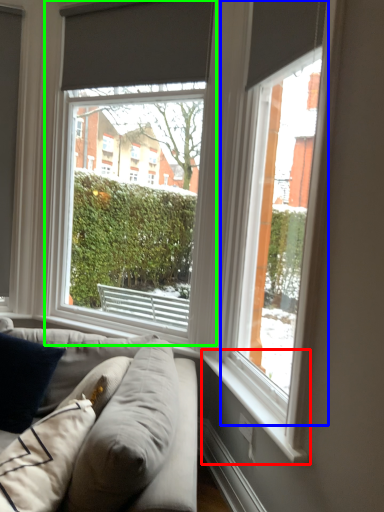
Question: Based on their relative distances, which object is nearer to window sill (highlighted by a red box)? Choose from window (highlighted by a blue box) and window (highlighted by a green box).

Choices:
 (A) window
 (B) window

Answer: (A)